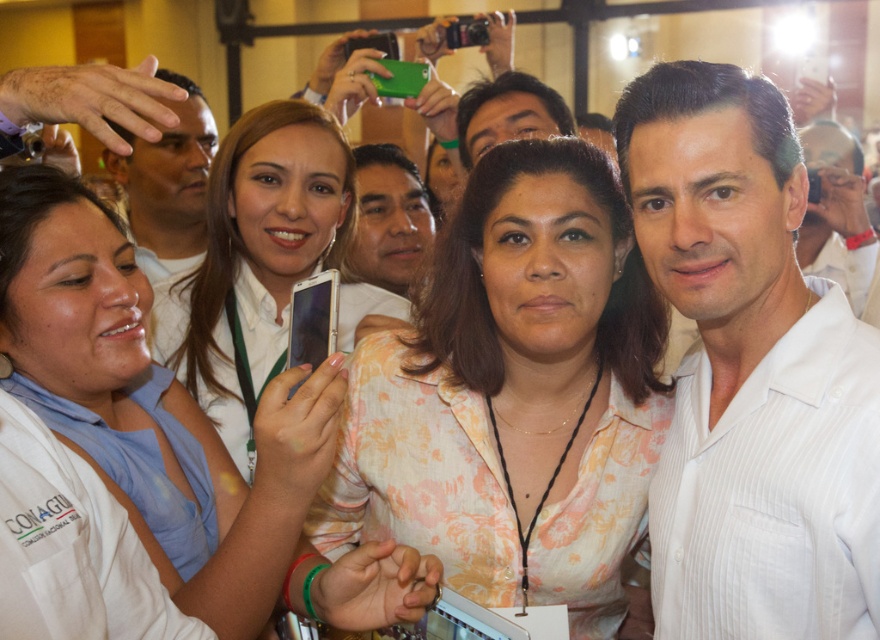
Which is more to the right, floral print blouse at center or white fabric shirt at center?

floral print blouse at center

Does floral print blouse at center have a smaller size compared to white fabric shirt at center?

Yes.

This screenshot has height=640, width=880. Describe the element at coordinates (512, 394) in the screenshot. I see `floral print blouse at center` at that location.

In order to click on floral print blouse at center in this screenshot , I will do `click(512, 394)`.

Is floral print blouse at center thinner than matte white phone at center?

No, floral print blouse at center is not thinner than matte white phone at center.

In the scene shown: Does floral print blouse at center appear on the right side of matte white phone at center?

Correct, you'll find floral print blouse at center to the right of matte white phone at center.

Is point (622, 605) positioned before point (352, 284)?

Yes, it is.

Find the location of a particular element. floral print blouse at center is located at coordinates (512, 394).

Does white fabric shirt at center have a larger size compared to matte white shirt at center?

No, white fabric shirt at center is not bigger than matte white shirt at center.

Is white fabric shirt at center shorter than matte white shirt at center?

Correct, white fabric shirt at center is not as tall as matte white shirt at center.

Identify the location of white fabric shirt at center. (154, 404).

Locate an element on the screen. Image resolution: width=880 pixels, height=640 pixels. white fabric shirt at center is located at coordinates (154, 404).